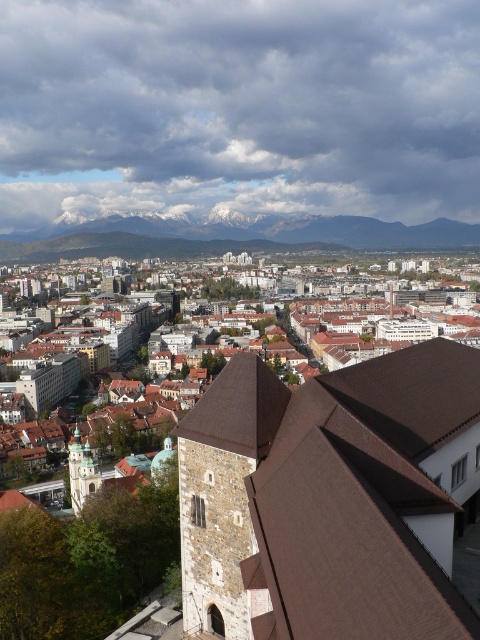
Who is taller, stone tower at center or golden stone tower at center?

Standing taller between the two is stone tower at center.

Is stone tower at center closer to the viewer compared to golden stone tower at center?

Yes, it is in front of golden stone tower at center.

The width and height of the screenshot is (480, 640). Describe the element at coordinates (223, 490) in the screenshot. I see `stone tower at center` at that location.

You are a GUI agent. You are given a task and a screenshot of the screen. Output one action in this format:
    pyautogui.click(x=<x>, y=<y>)
    Task: Click on the stone tower at center
    
    Given the screenshot: What is the action you would take?
    pyautogui.click(x=223, y=490)

Does point (471, 230) lie behind point (93, 481)?

That is True.

Looking at this image, who is higher up, white snow-covered mountain at upper center or golden stone tower at center?

white snow-covered mountain at upper center is above.

Between point (239, 236) and point (74, 435), which one is positioned behind?

Positioned behind is point (239, 236).

The height and width of the screenshot is (640, 480). I want to click on white snow-covered mountain at upper center, so click(231, 236).

Which is in front, point (268, 326) or point (86, 452)?

Point (86, 452) is in front.

Does point (399, 346) come in front of point (72, 497)?

No, (399, 346) is further to viewer.

Where is `brown tiled roof at center`? brown tiled roof at center is located at coordinates (363, 387).